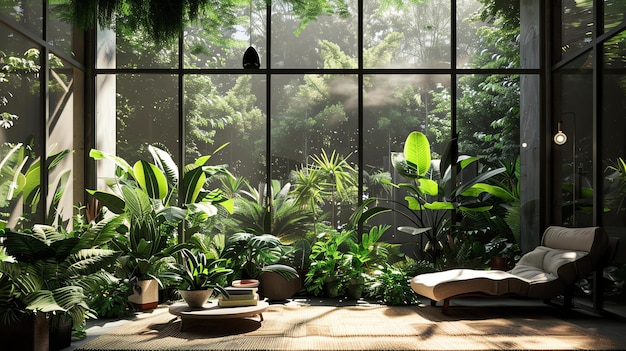
What are the coordinates of `potted plants` in the screenshot? It's located at (36, 334), (64, 336), (151, 296), (192, 295), (436, 245).